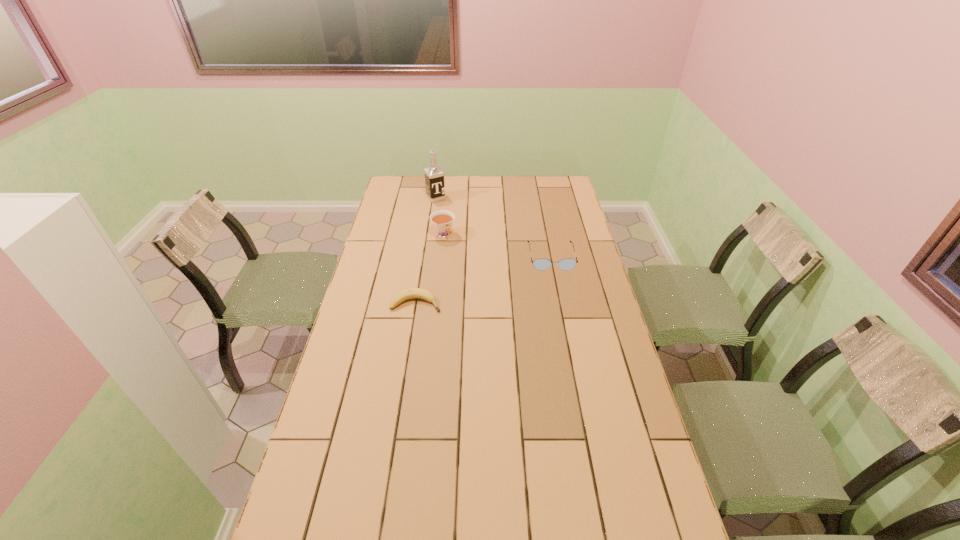
The image size is (960, 540). Find the location of `banana`. banana is located at coordinates (412, 293).

You are a GUI agent. You are given a task and a screenshot of the screen. Output one action in this format:
    pyautogui.click(x=<x>, y=<y>)
    Task: Click on the nearest object
    The width and height of the screenshot is (960, 540).
    Given the screenshot: What is the action you would take?
    pyautogui.click(x=412, y=293)

I want to click on the second nearest object, so click(x=540, y=264).

Where is `the third tallest object`? the third tallest object is located at coordinates (540, 264).

In order to click on teacup in this screenshot , I will do `click(442, 220)`.

Identify the location of the third nearest object. (442, 220).

Where is `the tallest object`? the tallest object is located at coordinates click(x=434, y=176).

Find the location of a particular element. the farthest object is located at coordinates (434, 176).

You are a GUI agent. You are given a task and a screenshot of the screen. Output one action in this format:
    pyautogui.click(x=<x>, y=<y>)
    Task: Click on the vacant space located at the stem of the shortest object
    The height and width of the screenshot is (540, 960).
    Given the screenshot: What is the action you would take?
    pyautogui.click(x=485, y=303)

The height and width of the screenshot is (540, 960). I want to click on free location located 0.090m on the lenses of the second nearest object, so click(x=557, y=287).